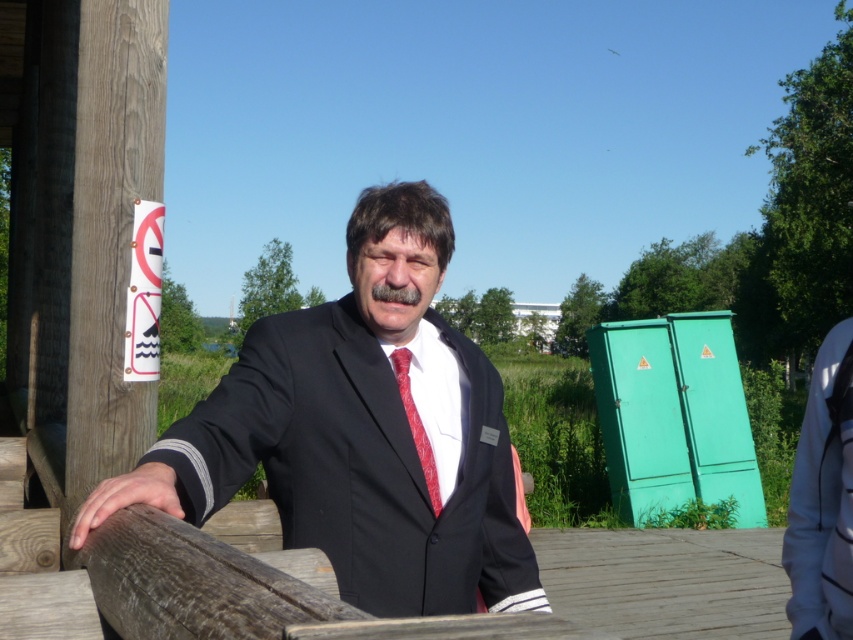
In order to click on white fabric at right in this screenshot , I will do `click(822, 499)`.

Is white fabric at right thinner than red satin tie at center?

In fact, white fabric at right might be wider than red satin tie at center.

Image resolution: width=853 pixels, height=640 pixels. Find the location of `white fabric at right`. white fabric at right is located at coordinates (822, 499).

You are a GUI agent. You are given a task and a screenshot of the screen. Output one action in this format:
    pyautogui.click(x=<x>, y=<y>)
    Task: Click on the white fabric at right
    
    Given the screenshot: What is the action you would take?
    pyautogui.click(x=822, y=499)

Between matte black suit at center and white fabric at right, which one is positioned lower?

Positioned lower is white fabric at right.

Between matte black suit at center and white fabric at right, which one appears on the left side from the viewer's perspective?

matte black suit at center

This screenshot has height=640, width=853. I want to click on matte black suit at center, so click(360, 433).

Can you confirm if matte black suit at center is positioned to the left of red satin tie at center?

Correct, you'll find matte black suit at center to the left of red satin tie at center.

Between matte black suit at center and red satin tie at center, which one appears on the right side from the viewer's perspective?

red satin tie at center is more to the right.

Is point (425, 580) farther from viewer compared to point (416, 445)?

No, (425, 580) is in front of (416, 445).

Image resolution: width=853 pixels, height=640 pixels. What are the coordinates of `matte black suit at center` in the screenshot? It's located at (360, 433).